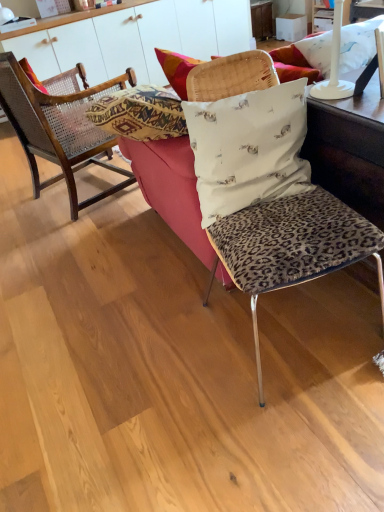
Locate an element on the screen. The width and height of the screenshot is (384, 512). free point in front of leopard print cushion at center, the 1th chair positioned from the front is located at coordinates [289, 438].